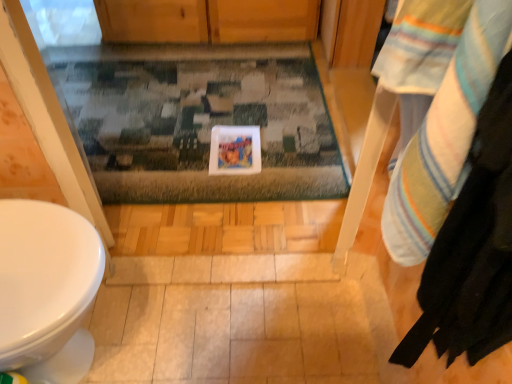
Question: Is multicolored textured rug at center taller or shorter than striped cotton towel at right?

Choices:
 (A) tall
 (B) short

Answer: (B)

Question: Considering the positions of multicolored textured rug at center and striped cotton towel at right in the image, is multicolored textured rug at center wider or thinner than striped cotton towel at right?

Choices:
 (A) thin
 (B) wide

Answer: (B)

Question: From the image's perspective, is multicolored textured rug at center above or below striped cotton towel at right?

Choices:
 (A) below
 (B) above

Answer: (B)

Question: From their relative heights in the image, would you say striped cotton towel at right is taller or shorter than multicolored textured rug at center?

Choices:
 (A) short
 (B) tall

Answer: (B)

Question: Is striped cotton towel at right wider or thinner than multicolored textured rug at center?

Choices:
 (A) thin
 (B) wide

Answer: (A)

Question: Is striped cotton towel at right in front of or behind multicolored textured rug at center in the image?

Choices:
 (A) front
 (B) behind

Answer: (A)

Question: Is striped cotton towel at right inside the boundaries of multicolored textured rug at center, or outside?

Choices:
 (A) inside
 (B) outside

Answer: (B)